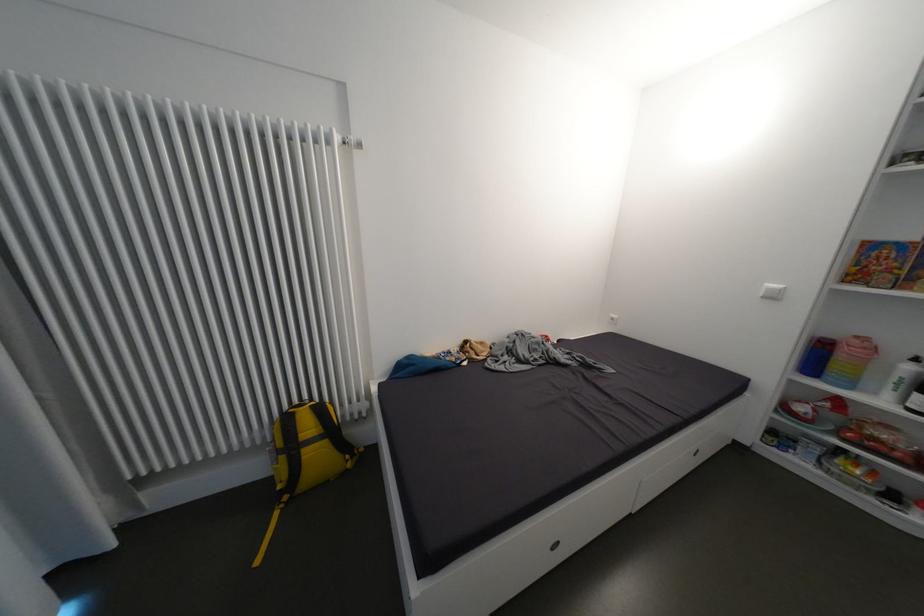
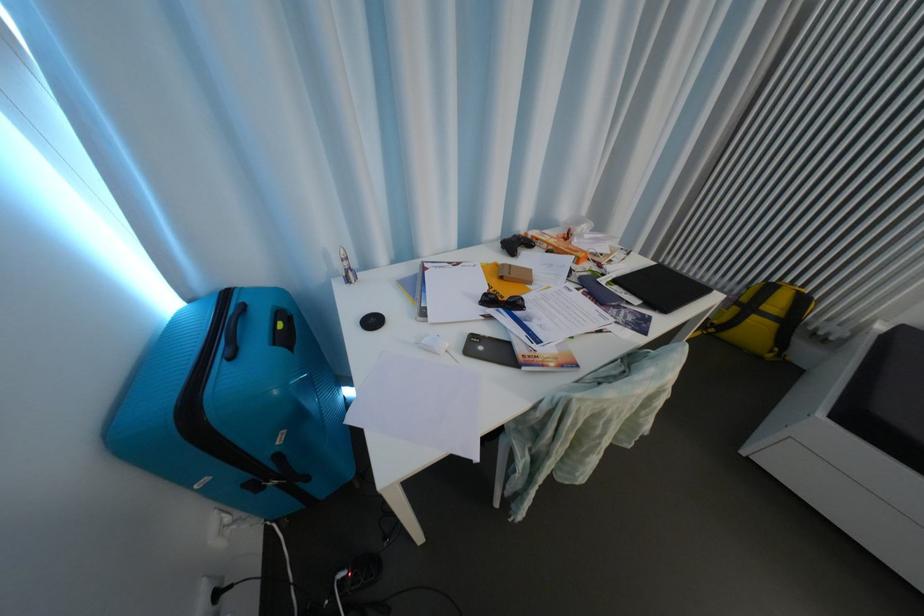
The images are taken continuously from a first-person perspective. In which direction is your viewpoint rotating?

The camera's rotation is toward left-down.